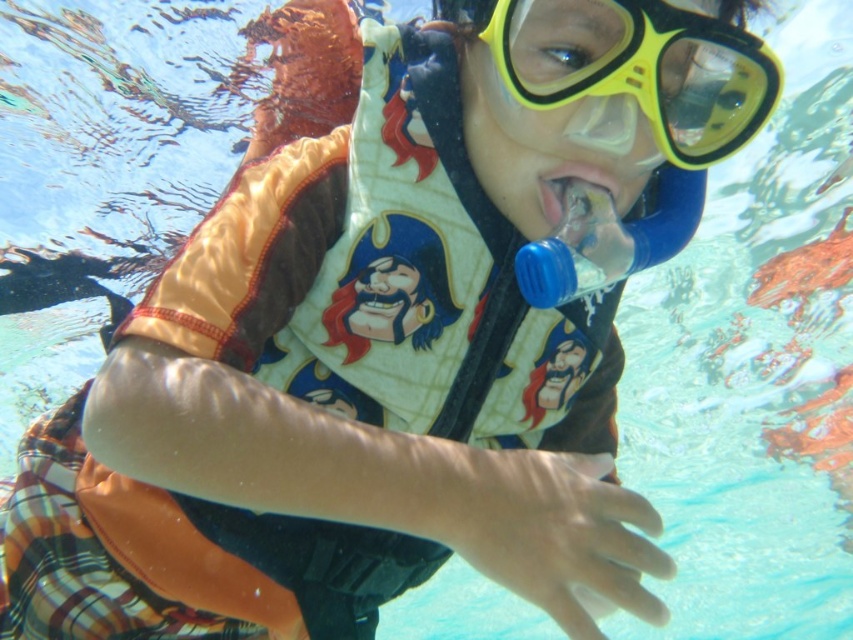
Does blue plastic bottle at center appear on the right side of translucent plastic mouth at center?

Yes, blue plastic bottle at center is to the right of translucent plastic mouth at center.

Is the position of blue plastic bottle at center less distant than that of translucent plastic mouth at center?

Yes, blue plastic bottle at center is closer to the viewer.

The height and width of the screenshot is (640, 853). What do you see at coordinates (608, 240) in the screenshot?
I see `blue plastic bottle at center` at bounding box center [608, 240].

I want to click on blue plastic bottle at center, so click(x=608, y=240).

Who is more distant from viewer, (758, 118) or (608, 234)?

Positioned behind is point (758, 118).

Find the location of `yellow matte snorkel mask at upper center`. yellow matte snorkel mask at upper center is located at coordinates (639, 67).

This screenshot has height=640, width=853. What do you see at coordinates (639, 67) in the screenshot?
I see `yellow matte snorkel mask at upper center` at bounding box center [639, 67].

This screenshot has height=640, width=853. Find the location of `yellow matte snorkel mask at upper center`. yellow matte snorkel mask at upper center is located at coordinates (639, 67).

Does yellow matte snorkel mask at upper center have a larger size compared to translucent plastic mouth at center?

Yes, yellow matte snorkel mask at upper center is bigger than translucent plastic mouth at center.

Is point (552, 52) more distant than point (561, 172)?

No, it is in front of (561, 172).

Describe the element at coordinates (639, 67) in the screenshot. The height and width of the screenshot is (640, 853). I see `yellow matte snorkel mask at upper center` at that location.

This screenshot has width=853, height=640. Find the location of `yellow matte snorkel mask at upper center`. yellow matte snorkel mask at upper center is located at coordinates (639, 67).